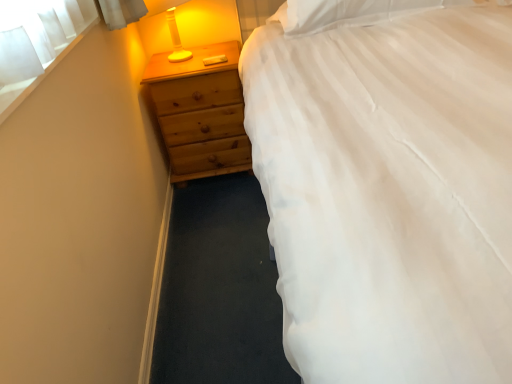
Describe the element at coordinates (346, 12) in the screenshot. I see `white soft pillow at upper right` at that location.

I want to click on wooden chest of drawers at left, so click(200, 112).

What do you see at coordinates (38, 47) in the screenshot? I see `white fabric at upper left` at bounding box center [38, 47].

You are a GUI agent. You are given a task and a screenshot of the screen. Output one action in this format:
    pyautogui.click(x=<x>, y=<y>)
    Task: Click on the white soft pillow at upper right
    This screenshot has height=384, width=512.
    Given the screenshot: What is the action you would take?
    pyautogui.click(x=346, y=12)

Between white soft pillow at upper right and wooden chest of drawers at left, which one has more height?

wooden chest of drawers at left is taller.

Is white soft pillow at upper right bigger or smaller than wooden chest of drawers at left?

Considering their sizes, white soft pillow at upper right takes up less space than wooden chest of drawers at left.

Which object is closer to the camera taking this photo, white soft pillow at upper right or wooden chest of drawers at left?

white soft pillow at upper right.

Between point (352, 4) and point (179, 173), which one is positioned behind?

The point (179, 173) is farther.

Between wooden chest of drawers at left and white fabric at upper left, which one is positioned behind?

wooden chest of drawers at left is behind.

Which is less distant, (221, 83) or (3, 66)?

Point (221, 83) is positioned farther from the camera compared to point (3, 66).

Is wooden chest of drawers at left shorter than white fabric at upper left?

Incorrect, the height of wooden chest of drawers at left does not fall short of that of white fabric at upper left.

Is wooden chest of drawers at left positioned far away from white fabric at upper left?

wooden chest of drawers at left is near white fabric at upper left, not far away.

Considering the relative positions of white fabric at upper left and white soft pillow at upper right in the image provided, is white fabric at upper left to the left or to the right of white soft pillow at upper right?

Based on their positions, white fabric at upper left is located to the left of white soft pillow at upper right.

In the scene shown: Which is correct: white fabric at upper left is inside white soft pillow at upper right, or outside of it?

white fabric at upper left is spatially situated outside white soft pillow at upper right.

Is white fabric at upper left oriented towards white soft pillow at upper right?

No, white fabric at upper left is not oriented towards white soft pillow at upper right.

Considering the points (382, 1) and (83, 19), which point is behind, point (382, 1) or point (83, 19)?

Point (382, 1)

Is the surface of white soft pillow at upper right in direct contact with white fabric at upper left?

No, white soft pillow at upper right is not in contact with white fabric at upper left.

From the image's perspective, does white soft pillow at upper right appear higher than white fabric at upper left?

Correct, white soft pillow at upper right appears higher than white fabric at upper left in the image.

Is white soft pillow at upper right aimed at white fabric at upper left?

No, white soft pillow at upper right is not oriented towards white fabric at upper left.

How far apart are wooden chest of drawers at left and white soft pillow at upper right?

wooden chest of drawers at left is 23.56 inches from white soft pillow at upper right.

From the image's perspective, who appears lower, wooden chest of drawers at left or white soft pillow at upper right?

From the image's view, wooden chest of drawers at left is below.

Find the location of a particular element. pillow that is on the right side of wooden chest of drawers at left is located at coordinates (346, 12).

How different are the orientations of wooden chest of drawers at left and white soft pillow at upper right in degrees?

0.147 degrees.

From a real-world perspective, which is physically below, white fabric at upper left or wooden chest of drawers at left?

In real-world perspective, wooden chest of drawers at left is lower.

In the image, is white fabric at upper left positioned in front of or behind wooden chest of drawers at left?

Clearly, white fabric at upper left is in front of wooden chest of drawers at left.

Which of these two, white fabric at upper left or wooden chest of drawers at left, stands shorter?

Standing shorter between the two is white fabric at upper left.

Could you tell me if white fabric at upper left is facing wooden chest of drawers at left?

No, white fabric at upper left is not oriented towards wooden chest of drawers at left.

Image resolution: width=512 pixels, height=384 pixels. What are the coordinates of `chest of drawers below the white soft pillow at upper right (from the image's perspective)` in the screenshot? It's located at (200, 112).

At what (x,y) coordinates should I click in order to perform the action: click on window screen in front of the wooden chest of drawers at left. Please return your answer as a coordinate pair (x, y). Looking at the image, I should click on (38, 47).

When comparing their distances from wooden chest of drawers at left, does white fabric at upper left or white soft pillow at upper right seem closer?

white soft pillow at upper right.

Considering their positions, is wooden chest of drawers at left positioned further to white fabric at upper left than white soft pillow at upper right?

white soft pillow at upper right.

When comparing their distances from wooden chest of drawers at left, does white soft pillow at upper right or white fabric at upper left seem closer?

white soft pillow at upper right is closer to wooden chest of drawers at left.

Based on their spatial positions, is white fabric at upper left or wooden chest of drawers at left closer to white soft pillow at upper right?

wooden chest of drawers at left is positioned closer to the anchor white soft pillow at upper right.

When comparing their distances from white fabric at upper left, does white soft pillow at upper right or wooden chest of drawers at left seem further?

The object further to white fabric at upper left is white soft pillow at upper right.

From the image, which object appears to be farther from white soft pillow at upper right, wooden chest of drawers at left or white fabric at upper left?

white fabric at upper left is further to white soft pillow at upper right.

This screenshot has width=512, height=384. I want to click on pillow between white fabric at upper left and wooden chest of drawers at left from front to back, so click(346, 12).